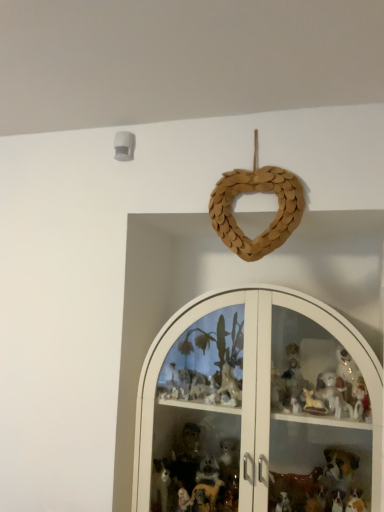
Question: Considering the relative positions of braided wood heart at upper center and white glass cabinet at center in the image provided, is braided wood heart at upper center to the right of white glass cabinet at center from the viewer's perspective?

Choices:
 (A) yes
 (B) no

Answer: (B)

Question: From the image's perspective, is braided wood heart at upper center under white glass cabinet at center?

Choices:
 (A) no
 (B) yes

Answer: (A)

Question: Is braided wood heart at upper center shorter than white glass cabinet at center?

Choices:
 (A) no
 (B) yes

Answer: (B)

Question: Considering the relative sizes of braided wood heart at upper center and white glass cabinet at center in the image provided, is braided wood heart at upper center bigger than white glass cabinet at center?

Choices:
 (A) no
 (B) yes

Answer: (A)

Question: From the image's perspective, does braided wood heart at upper center appear higher than white glass cabinet at center?

Choices:
 (A) no
 (B) yes

Answer: (B)

Question: Is braided wood heart at upper center oriented towards white glass cabinet at center?

Choices:
 (A) no
 (B) yes

Answer: (A)

Question: Does white glass cabinet at center have a larger size compared to braided wood heart at upper center?

Choices:
 (A) no
 (B) yes

Answer: (B)

Question: Would you say white glass cabinet at center contains braided wood heart at upper center?

Choices:
 (A) yes
 (B) no

Answer: (B)

Question: Can we say white glass cabinet at center lies outside braided wood heart at upper center?

Choices:
 (A) yes
 (B) no

Answer: (A)

Question: From a real-world perspective, is white glass cabinet at center located beneath braided wood heart at upper center?

Choices:
 (A) yes
 (B) no

Answer: (A)

Question: Can you confirm if white glass cabinet at center is wider than braided wood heart at upper center?

Choices:
 (A) yes
 (B) no

Answer: (A)

Question: Is white glass cabinet at center directly adjacent to braided wood heart at upper center?

Choices:
 (A) no
 (B) yes

Answer: (A)

Question: Considering the positions of white glass cabinet at center and braided wood heart at upper center in the image, is white glass cabinet at center wider or thinner than braided wood heart at upper center?

Choices:
 (A) thin
 (B) wide

Answer: (B)